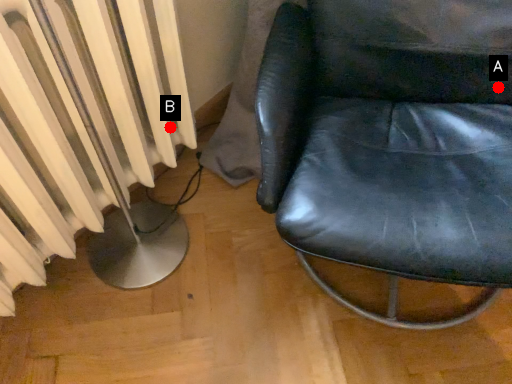
Question: Two points are circled on the image, labeled by A and B beside each circle. Which point is farther from the camera taking this photo?

Choices:
 (A) A is further
 (B) B is further

Answer: (B)